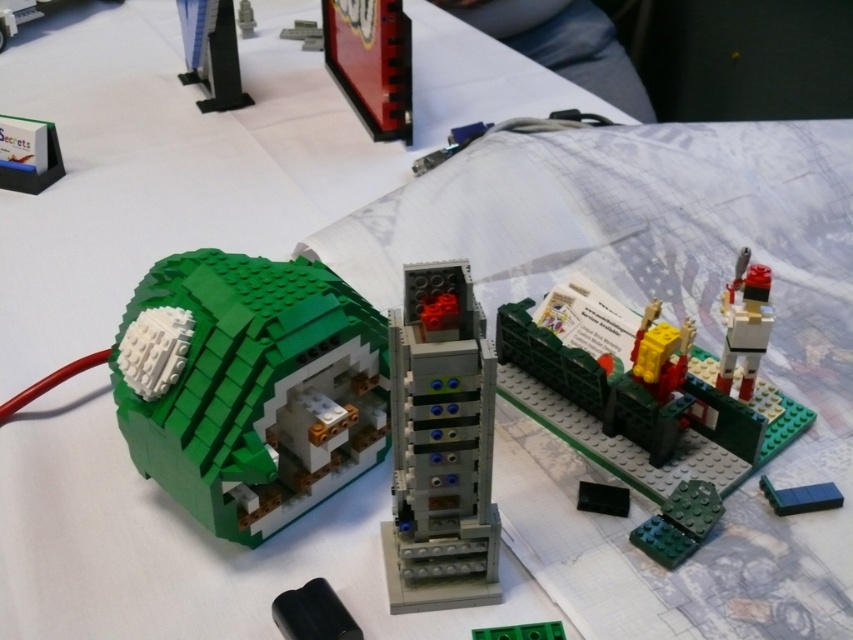
You are a customer at a LEGO store looking at the display. You notice the brick red plastic sign at upper center and the green plastic plate at lower right. Which object is placed higher in the image?

The brick red plastic sign at upper center is positioned over the green plastic plate at lower right, so it is placed higher in the image.

You are looking at the LEGO construction set on the table. There are two points marked in the image. The first point is at coordinate (648, 522) and the second is at (767, 484). Which of these two points is closer to you?

Point (648, 522) is closer to the camera than point (767, 484), so the first point is closer to you.